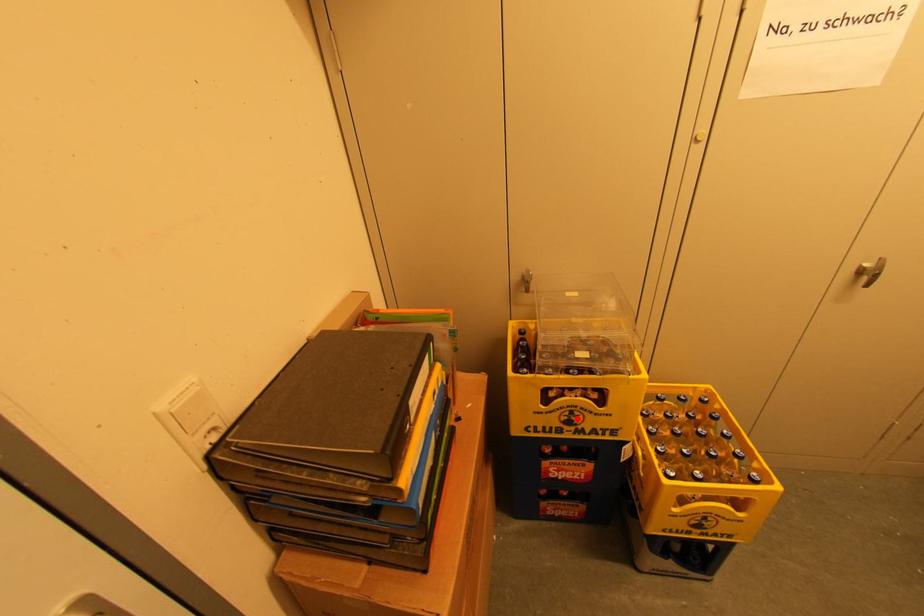
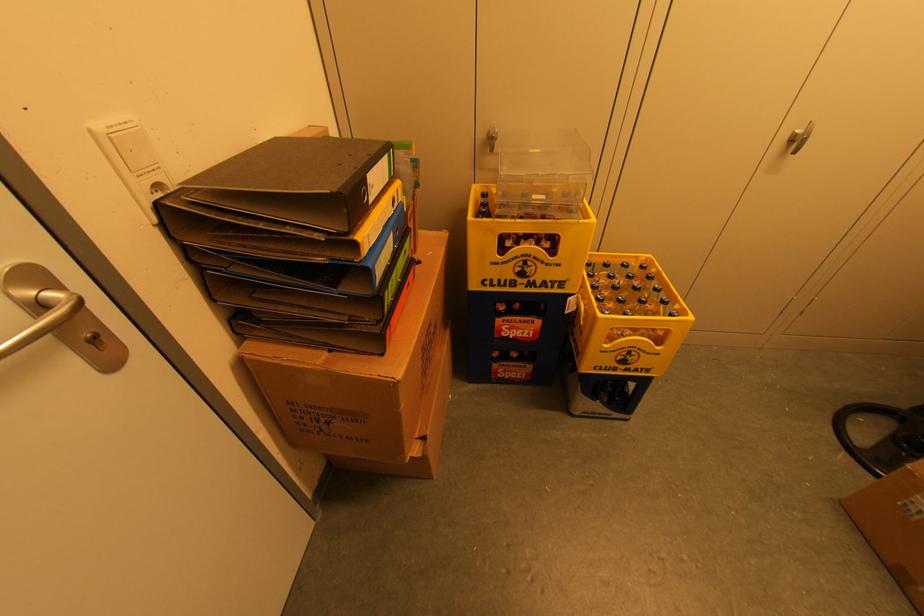
In the second image, find the point that corresponds to the highlighted location in the first image.

(530, 270)